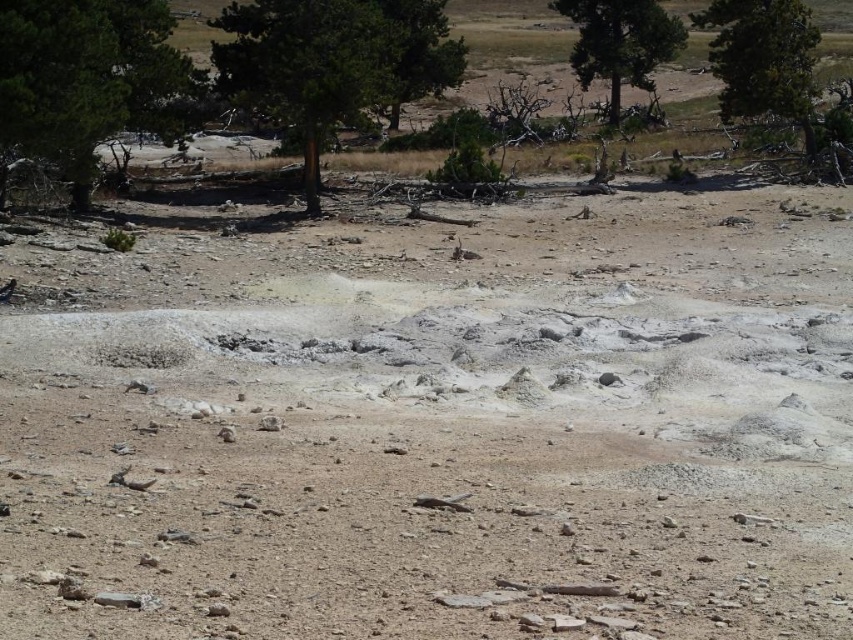
You are standing in the barren landscape described. A treasure is buried at point (142,115). If you walk straight ahead, will you reach the treasure before walking 30 meters?

The distance between you and point (142,115) is 28.59 meters, so yes, you will reach the treasure before walking 30 meters.

Based on the photo, you are standing at the point closest to the viewer in this barren landscape. Which point are you at, point (419, 54) or point (726, 20)?

You are at point (419, 54) because it is closer to the viewer than point (726, 20).